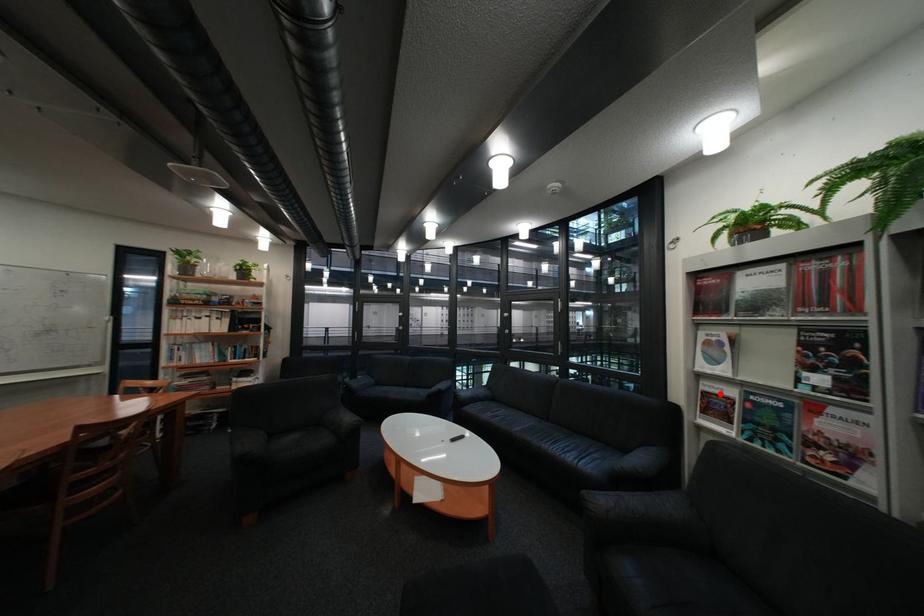
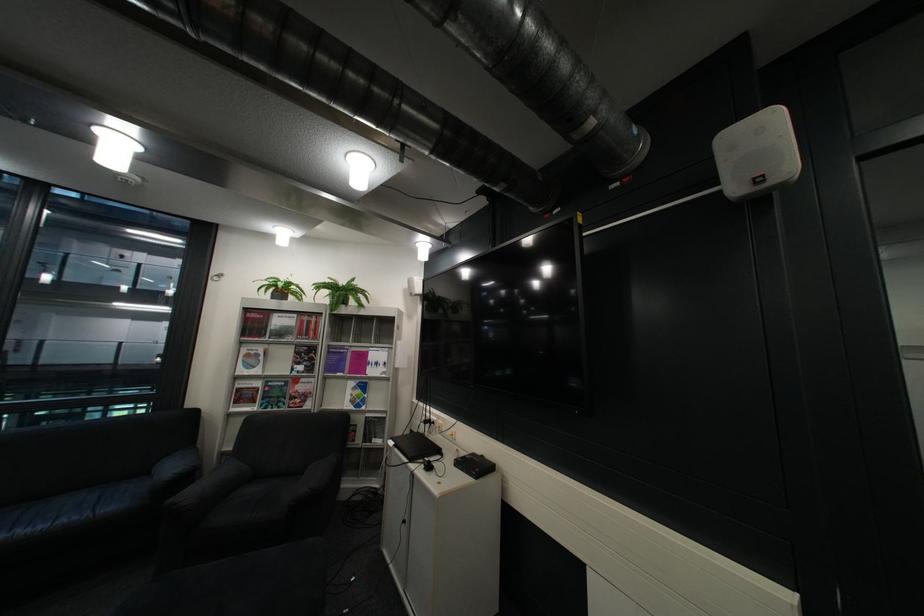
In the second image, find the point that corresponds to the highlighted location in the first image.

(254, 390)